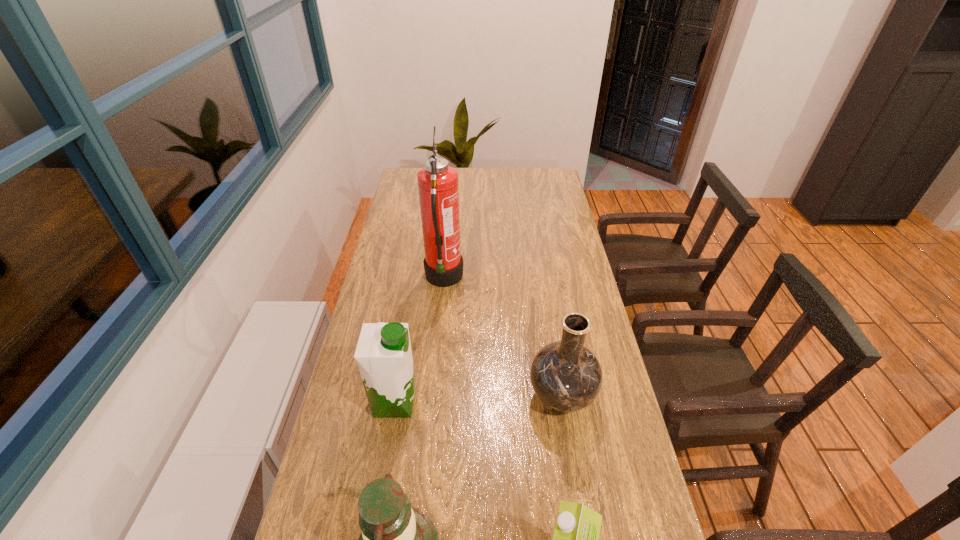
At what (x,y) coordinates should I click in order to perform the action: click on fire extinguisher. Please return your answer as a coordinate pair (x, y). The width and height of the screenshot is (960, 540). Looking at the image, I should click on (438, 187).

Identify the location of the farthest object. (438, 187).

This screenshot has width=960, height=540. In order to click on vase in this screenshot , I will do tap(566, 376).

Identify the location of the farther soya milk. The width and height of the screenshot is (960, 540). (384, 356).

At what (x,y) coordinates should I click in order to perform the action: click on the left soya milk. Please return your answer as a coordinate pair (x, y). The height and width of the screenshot is (540, 960). Looking at the image, I should click on (384, 356).

This screenshot has height=540, width=960. I want to click on free space located 0.290m on the front-facing side of the tallest object, so pyautogui.click(x=544, y=279).

In order to click on blank area located 0.360m on the left of the vase in this screenshot , I will do point(397,396).

Where is `vacant space located 0.110m on the front-facing side of the farther soya milk`? vacant space located 0.110m on the front-facing side of the farther soya milk is located at coordinates (459, 402).

Where is `object at the left edge`? The width and height of the screenshot is (960, 540). object at the left edge is located at coordinates (384, 356).

The width and height of the screenshot is (960, 540). I want to click on object that is at the right edge, so click(566, 376).